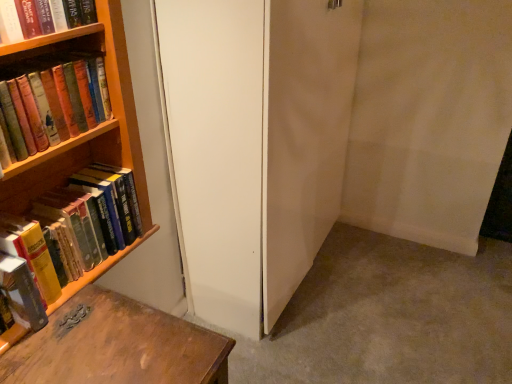
Question: Is hardcover book at left, the first book in the bottom-to-top sequence, at the right side of hardcover books at left, marked as the 2th book in a top-to-bottom arrangement?

Choices:
 (A) yes
 (B) no

Answer: (B)

Question: Does hardcover book at left, the first book in the bottom-to-top sequence, have a lesser height compared to hardcover books at left, marked as the 2th book in a top-to-bottom arrangement?

Choices:
 (A) no
 (B) yes

Answer: (B)

Question: Is hardcover book at left, the first book in the bottom-to-top sequence, thinner than hardcover books at left, marked as the 2th book in a top-to-bottom arrangement?

Choices:
 (A) yes
 (B) no

Answer: (B)

Question: Would you say hardcover books at left, marked as the 2th book in a top-to-bottom arrangement, is part of hardcover book at left, positioned as the fourth book in top-to-bottom order,'s contents?

Choices:
 (A) no
 (B) yes

Answer: (A)

Question: Is hardcover book at left, the first book in the bottom-to-top sequence, next to hardcover books at left, which appears as the 3th book when ordered from the bottom, and touching it?

Choices:
 (A) yes
 (B) no

Answer: (B)

Question: From a real-world perspective, does hardcover book at left, positioned as the fourth book in top-to-bottom order, sit lower than hardcover books at left, marked as the 2th book in a top-to-bottom arrangement?

Choices:
 (A) yes
 (B) no

Answer: (A)

Question: Is hardcover books at left, which appears as the 3th book when ordered from the bottom, to the left of hardcover book at upper left, marked as the first book in a top-to-bottom arrangement, from the viewer's perspective?

Choices:
 (A) yes
 (B) no

Answer: (A)

Question: From a real-world perspective, is hardcover books at left, marked as the 2th book in a top-to-bottom arrangement, under hardcover book at upper left, which is the 4th book in bottom-to-top order?

Choices:
 (A) no
 (B) yes

Answer: (B)

Question: Is hardcover book at upper left, which is the 4th book in bottom-to-top order, completely or partially inside hardcover books at left, marked as the 2th book in a top-to-bottom arrangement?

Choices:
 (A) yes
 (B) no

Answer: (B)

Question: Is the depth of hardcover books at left, marked as the 2th book in a top-to-bottom arrangement, less than that of hardcover book at upper left, marked as the first book in a top-to-bottom arrangement?

Choices:
 (A) yes
 (B) no

Answer: (A)

Question: Is hardcover books at left, marked as the 2th book in a top-to-bottom arrangement, smaller than hardcover book at upper left, which is the 4th book in bottom-to-top order?

Choices:
 (A) yes
 (B) no

Answer: (B)

Question: From the image's perspective, is hardcover books at left, which appears as the 3th book when ordered from the bottom, located beneath hardcover book at upper left, which is the 4th book in bottom-to-top order?

Choices:
 (A) no
 (B) yes

Answer: (B)

Question: Considering the relative sizes of hardcover books at left, which is the 2th book in bottom-to-top order, and hardcover book at left, the first book in the bottom-to-top sequence, in the image provided, is hardcover books at left, which is the 2th book in bottom-to-top order, smaller than hardcover book at left, the first book in the bottom-to-top sequence,?

Choices:
 (A) yes
 (B) no

Answer: (B)